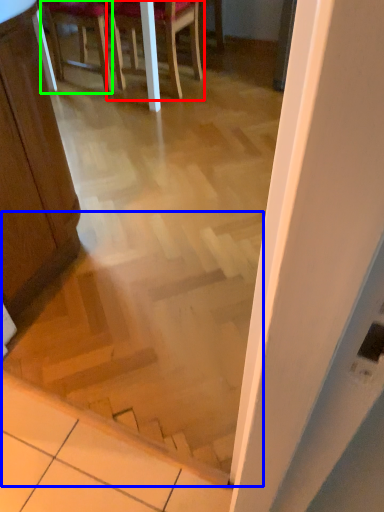
Question: Which is farther away from chair (highlighted by a red box)? stairwell (highlighted by a blue box) or chair (highlighted by a green box)?

Choices:
 (A) stairwell
 (B) chair

Answer: (A)